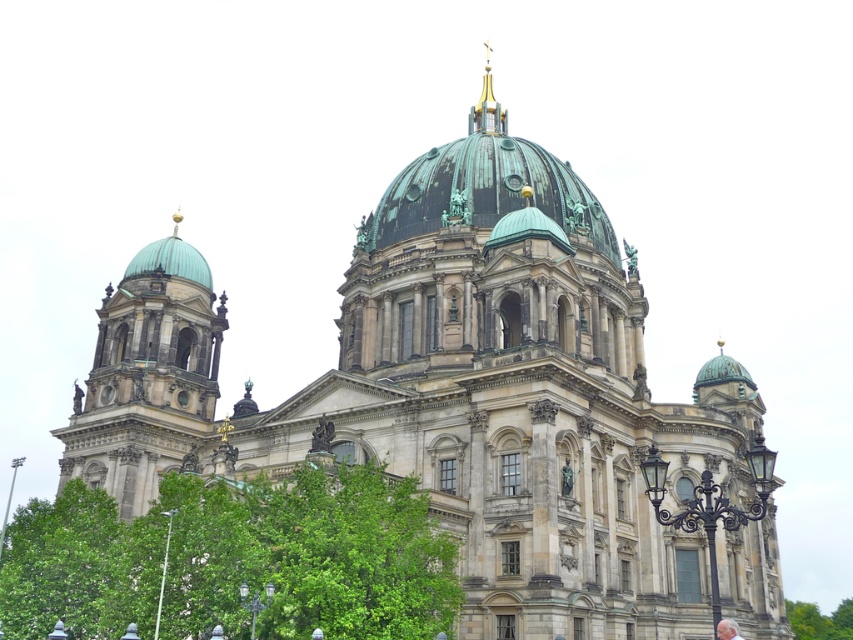
Does point (144, 636) come behind point (810, 611)?

No, (144, 636) is in front of (810, 611).

Between point (218, 582) and point (799, 620), which one is positioned behind?

The point (799, 620) is behind.

Where is `green leafy tree at center`? Image resolution: width=853 pixels, height=640 pixels. green leafy tree at center is located at coordinates (234, 561).

Is point (817, 637) more distant than point (482, 90)?

No, (817, 637) is in front of (482, 90).

Identify the location of green leafy tree at lower right. The width and height of the screenshot is (853, 640). (819, 620).

Image resolution: width=853 pixels, height=640 pixels. What are the coordinates of `green leafy tree at lower right` in the screenshot? It's located at [819, 620].

Which of these two, green leafy tree at center or green copper dome at left, stands taller?

green copper dome at left is taller.

Is point (39, 556) closer to camera compared to point (218, 394)?

Yes, point (39, 556) is closer to viewer.

Where is `green leafy tree at center`? green leafy tree at center is located at coordinates (234, 561).

The image size is (853, 640). In order to click on green leafy tree at center in this screenshot , I will do `click(234, 561)`.